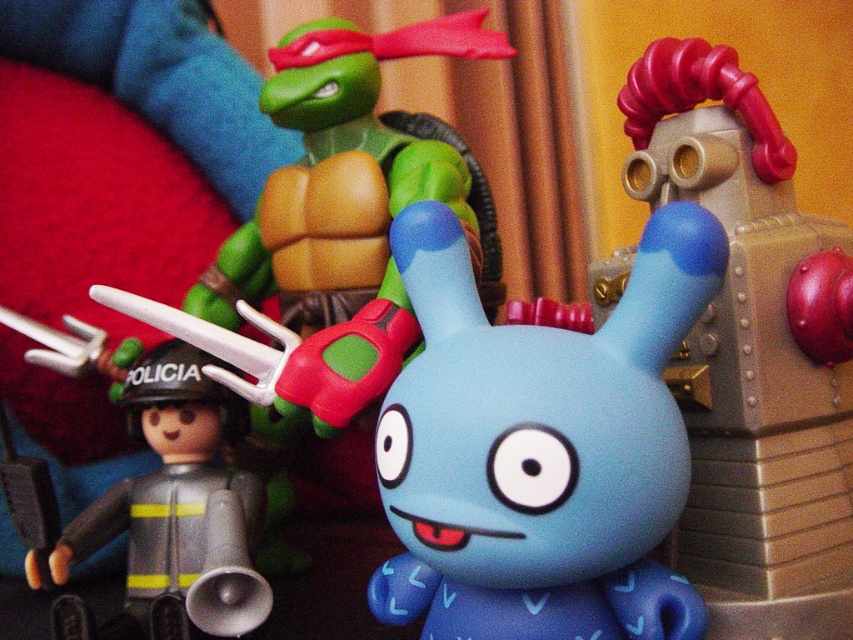
Consider the image. What is located at the coordinates point [538,449] in the image?

The point [538,449] corresponds to the blue matte toy at center.

You are holding a 12 inch ruler and want to measure the distance from your eyes to the point marked at coordinates (563, 524) in the image. Can you reach that point with your ruler?

The distance between the point marked at coordinates (563, 524) and the camera is 21.78 inches. Since your ruler is only 12 inches long, you cannot reach that point with your ruler.